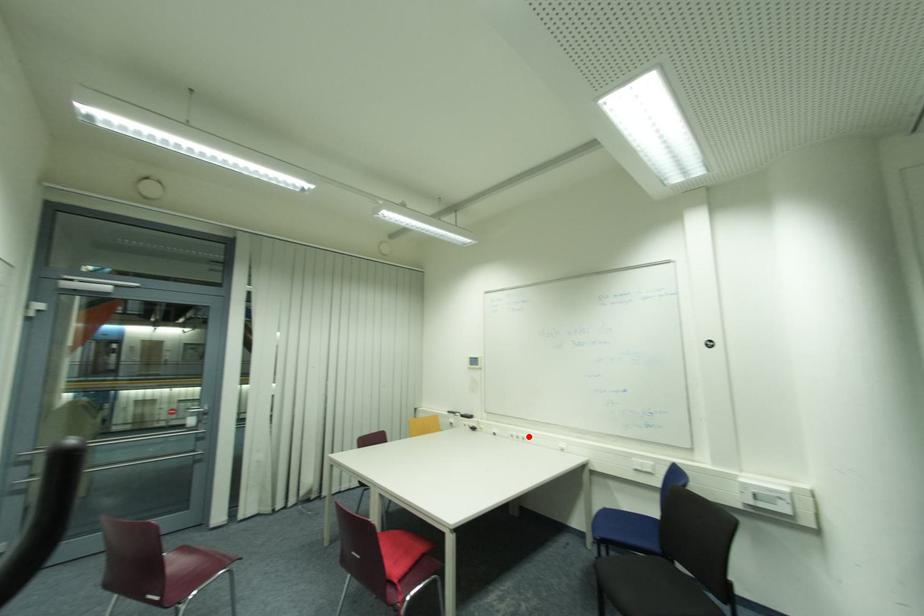
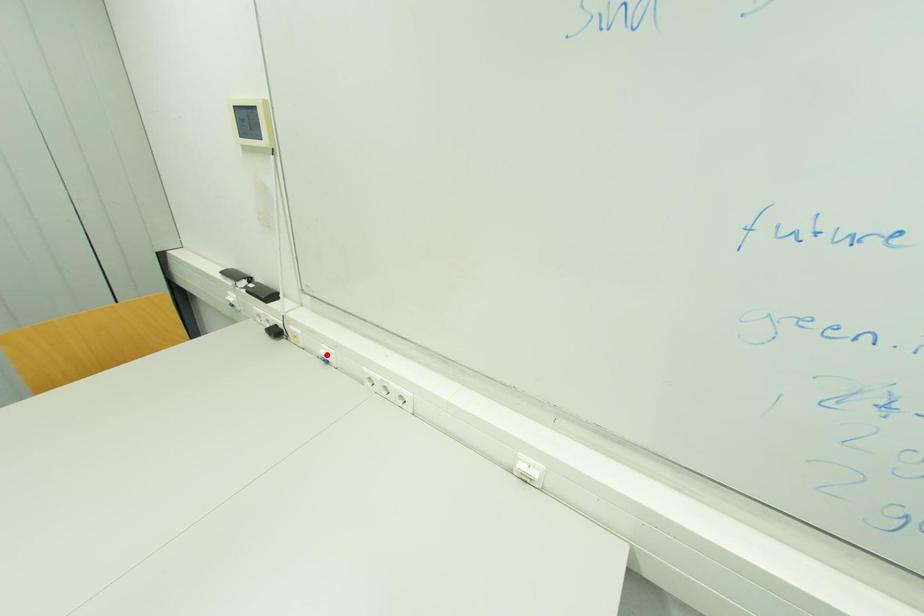
Looking at this image, I am providing you with two images of the same scene from different viewpoints. A red point is marked on the first image and another point is marked on the second image. Are the points marked in image1 and image2 representing the same 3D position?

No